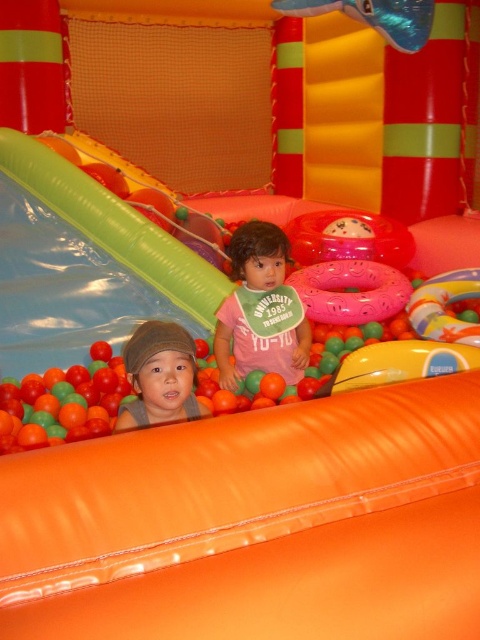
Question: Which point is closer to the camera?

Choices:
 (A) matte pink shirt at center
 (B) pink rubber ring at center

Answer: (A)

Question: Among these points, which one is farthest from the camera?

Choices:
 (A) (179, 257)
 (B) (474, 298)
 (C) (250, 236)
 (D) (175, 381)

Answer: (B)

Question: Based on their relative distances, which object is farther from the orange matte ball pit at lower left?

Choices:
 (A) green plastic slide at upper left
 (B) pink rubber ring at center
 (C) matte pink shirt at center

Answer: (B)

Question: Is matte pink shirt at center to the left of pink rubber ring at center from the viewer's perspective?

Choices:
 (A) yes
 (B) no

Answer: (A)

Question: Is the position of green plastic slide at upper left more distant than that of orange matte ball pit at lower left?

Choices:
 (A) no
 (B) yes

Answer: (B)

Question: Does green plastic slide at upper left have a greater width compared to matte pink shirt at center?

Choices:
 (A) no
 (B) yes

Answer: (B)